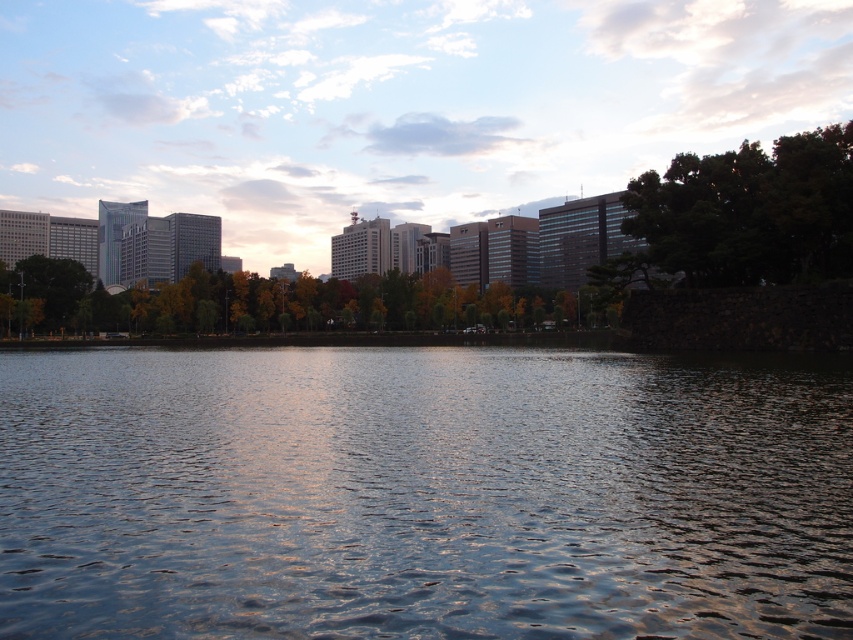
Does glistening water at center have a greater height compared to green leafy tree at center?

No, glistening water at center is not taller than green leafy tree at center.

Find the location of a particular element. Image resolution: width=853 pixels, height=640 pixels. glistening water at center is located at coordinates (422, 493).

Find the location of a particular element. The width and height of the screenshot is (853, 640). glistening water at center is located at coordinates (422, 493).

Does green leafy tree at upper right appear under green leafy tree at center?

No, green leafy tree at upper right is not below green leafy tree at center.

Between point (677, 241) and point (323, 305), which one is positioned in front?

Point (677, 241) is in front.

Is point (805, 250) in front of point (212, 278)?

That is True.

At what (x,y) coordinates should I click in order to perform the action: click on green leafy tree at upper right. Please return your answer as a coordinate pair (x, y). Looking at the image, I should click on (750, 211).

Can you confirm if glistening water at center is shorter than green leafy tree at upper right?

Indeed, glistening water at center has a lesser height compared to green leafy tree at upper right.

Which is more to the left, glistening water at center or green leafy tree at upper right?

glistening water at center is more to the left.

Between point (393, 536) and point (770, 256), which one is positioned in front?

Point (393, 536) is in front.

Where is `glistening water at center`? glistening water at center is located at coordinates (422, 493).